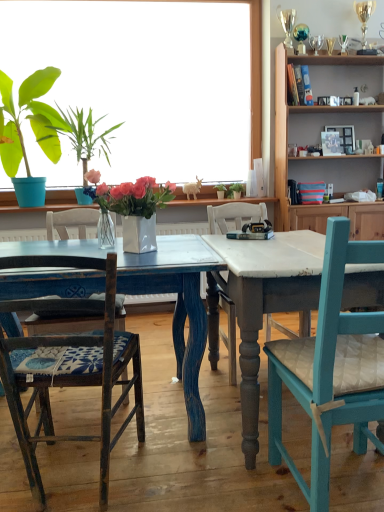
The width and height of the screenshot is (384, 512). Find the location of `green leafy plant at upper left, acting as the fourth houseplant starting from the right`. green leafy plant at upper left, acting as the fourth houseplant starting from the right is located at coordinates point(86,136).

At what (x,y) coordinates should I click in order to perform the action: click on white glossy vase at center, which appears as the fifth houseplant when viewed from the back. Please return your answer as a coordinate pair (x, y). The image size is (384, 512). Looking at the image, I should click on (135, 209).

Locate an element on the screen. This screenshot has height=512, width=384. green leafy plant in blue pot at left, which ranks as the fourth houseplant in back-to-front order is located at coordinates (32, 129).

This screenshot has height=512, width=384. What do you see at coordinates (331, 368) in the screenshot?
I see `teal wood chair at right, acting as the second chair starting from the left` at bounding box center [331, 368].

Where is `green leafy plant at upper left, acting as the 3th houseplant starting from the back`? green leafy plant at upper left, acting as the 3th houseplant starting from the back is located at coordinates (86, 136).

Is the position of green leafy plant at center, the 5th houseplant from the front, less distant than that of distressed blue wood table at center?

That is False.

Which of these two, green leafy plant at center, the first houseplant positioned from the right, or distressed blue wood table at center, is smaller?

green leafy plant at center, the first houseplant positioned from the right.

From a real-world perspective, does green leafy plant at center, the 5th houseplant from the front, stand above distressed blue wood table at center?

Yes, from a real-world perspective, green leafy plant at center, the 5th houseplant from the front, is above distressed blue wood table at center.

Which of these two, green leafy plant at center, which appears as the 1th houseplant when viewed from the back, or distressed blue wood table at center, is wider?

With larger width is distressed blue wood table at center.

Based on the photo, is wooden chair with blue patterned cushion at left, the second chair when ordered from right to left, inside or outside of green leafy plant at center, the 5th houseplant from the front?

wooden chair with blue patterned cushion at left, the second chair when ordered from right to left, lies outside green leafy plant at center, the 5th houseplant from the front.

Is wooden chair with blue patterned cushion at left, the second chair when ordered from right to left, in front of or behind green leafy plant at center, the first houseplant positioned from the right, in the image?

Visually, wooden chair with blue patterned cushion at left, the second chair when ordered from right to left, is located in front of green leafy plant at center, the first houseplant positioned from the right.

Measure the distance from wooden chair with blue patterned cushion at left, the second chair when ordered from right to left, to green leafy plant at center, the first houseplant positioned from the right.

wooden chair with blue patterned cushion at left, the second chair when ordered from right to left, is 2.24 meters away from green leafy plant at center, the first houseplant positioned from the right.

How different are the orientations of wooden chair with blue patterned cushion at left, the second chair when ordered from right to left, and green leafy plant at center, the first houseplant positioned from the right, in degrees?

The angle between the facing direction of wooden chair with blue patterned cushion at left, the second chair when ordered from right to left, and the facing direction of green leafy plant at center, the first houseplant positioned from the right, is 168 degrees.

Based on the photo, from the image's perspective, is green matte plant pot at center, which ranks as the second houseplant in right-to-left order, below white glossy vase at center, which ranks as the first houseplant in front-to-back order?

Incorrect, from the image's perspective, green matte plant pot at center, which ranks as the second houseplant in right-to-left order, is higher than white glossy vase at center, which ranks as the first houseplant in front-to-back order.

What's the angular difference between green matte plant pot at center, the 4th houseplant when ordered from left to right, and white glossy vase at center, which appears as the fifth houseplant when viewed from the back,'s facing directions?

The facing directions of green matte plant pot at center, the 4th houseplant when ordered from left to right, and white glossy vase at center, which appears as the fifth houseplant when viewed from the back, are 39.6 degrees apart.

Is green matte plant pot at center, which ranks as the second houseplant in back-to-front order, touching white glossy vase at center, which ranks as the first houseplant in front-to-back order?

No, green matte plant pot at center, which ranks as the second houseplant in back-to-front order, is not making contact with white glossy vase at center, which ranks as the first houseplant in front-to-back order.

Would you say teal wood chair at right, positioned as the 1th chair in right-to-left order, contains green leafy plant in blue pot at left, which is the 5th houseplant from right to left?

No, green leafy plant in blue pot at left, which is the 5th houseplant from right to left, is located outside of teal wood chair at right, positioned as the 1th chair in right-to-left order.

Which houseplant is the 5th one when counting from the left side of the teal wood chair at right, positioned as the 1th chair in right-to-left order? Please provide its 2D coordinates.

[(32, 129)]

Does point (278, 378) lie in front of point (30, 88)?

That is True.

Considering the sizes of white glossy vase at center, arranged as the third houseplant when viewed from the right, and wooden chair with blue patterned cushion at left, the second chair when ordered from right to left, in the image, is white glossy vase at center, arranged as the third houseplant when viewed from the right, bigger or smaller than wooden chair with blue patterned cushion at left, the second chair when ordered from right to left,?

In the image, white glossy vase at center, arranged as the third houseplant when viewed from the right, appears to be smaller than wooden chair with blue patterned cushion at left, the second chair when ordered from right to left.

Considering the sizes of white glossy vase at center, arranged as the third houseplant when viewed from the right, and wooden chair with blue patterned cushion at left, the second chair when ordered from right to left, in the image, is white glossy vase at center, arranged as the third houseplant when viewed from the right, taller or shorter than wooden chair with blue patterned cushion at left, the second chair when ordered from right to left,?

white glossy vase at center, arranged as the third houseplant when viewed from the right, is shorter than wooden chair with blue patterned cushion at left, the second chair when ordered from right to left.

How many degrees apart are the facing directions of teal wood chair at right, positioned as the 1th chair in right-to-left order, and wooden cabinet at upper right?

179 degrees separate the facing orientations of teal wood chair at right, positioned as the 1th chair in right-to-left order, and wooden cabinet at upper right.

From the image's perspective, would you say teal wood chair at right, positioned as the 1th chair in right-to-left order, is positioned over wooden cabinet at upper right?

No, from the image's perspective, teal wood chair at right, positioned as the 1th chair in right-to-left order, is not above wooden cabinet at upper right.

You are a GUI agent. You are given a task and a screenshot of the screen. Output one action in this format:
    pyautogui.click(x=<x>, y=<y>)
    Task: Click on the cabinetry that appears above the teal wood chair at right, acting as the second chair starting from the left (from a real-world perspective)
    The width and height of the screenshot is (384, 512).
    Given the screenshot: What is the action you would take?
    pyautogui.click(x=281, y=138)

Between teal wood chair at right, positioned as the 1th chair in right-to-left order, and wooden cabinet at upper right, which one has more height?

wooden cabinet at upper right is taller.

Which is in front, wooden chair with blue patterned cushion at left, the 1th chair when ordered from left to right, or green leafy plant in blue pot at left, which ranks as the fourth houseplant in back-to-front order?

wooden chair with blue patterned cushion at left, the 1th chair when ordered from left to right, is more forward.

From the image's perspective, does wooden chair with blue patterned cushion at left, the 1th chair when ordered from left to right, appear higher than green leafy plant in blue pot at left, which is the 5th houseplant from right to left?

No, from the image's perspective, wooden chair with blue patterned cushion at left, the 1th chair when ordered from left to right, is not on top of green leafy plant in blue pot at left, which is the 5th houseplant from right to left.

Locate an element on the screen. This screenshot has width=384, height=512. the 2nd houseplant to the left of the wooden chair with blue patterned cushion at left, the 1th chair when ordered from left to right, starting your count from the anchor is located at coordinates (32, 129).

In order to click on the 5th houseplant behind when counting from the distressed blue wood table at center in this screenshot , I will do `click(236, 190)`.

Identify the location of houseplant that is the 3rd object to the right of the wooden chair with blue patterned cushion at left, the 1th chair when ordered from left to right, starting at the anchor. (236, 190).

Based on their spatial positions, is green leafy plant at center, placed as the fifth houseplant when sorted from left to right, or wooden cabinet at upper right closer to wooden chair with blue patterned cushion at left, the 1th chair when ordered from left to right?

wooden cabinet at upper right is positioned closer to the anchor wooden chair with blue patterned cushion at left, the 1th chair when ordered from left to right.

Estimate the real-world distances between objects in this image. Which object is further from distressed blue wood table at center, green leafy plant in blue pot at left, which is the 5th houseplant from right to left, or wooden chair with blue patterned cushion at left, the 1th chair when ordered from left to right?

green leafy plant in blue pot at left, which is the 5th houseplant from right to left, is positioned further to the anchor distressed blue wood table at center.

Based on the photo, based on their spatial positions, is white glossy vase at center, arranged as the third houseplant when viewed from the right, or green matte plant pot at center, which ranks as the second houseplant in right-to-left order, closer to wooden cabinet at upper right?

green matte plant pot at center, which ranks as the second houseplant in right-to-left order.

When comparing their distances from wooden chair with blue patterned cushion at left, the second chair when ordered from right to left, does teal wood chair at right, acting as the second chair starting from the left, or green leafy plant in blue pot at left, which ranks as the fourth houseplant in back-to-front order, seem further?

green leafy plant in blue pot at left, which ranks as the fourth houseplant in back-to-front order, lies further to wooden chair with blue patterned cushion at left, the second chair when ordered from right to left, than the other object.

Which object lies nearer to the anchor point green leafy plant at upper left, acting as the 3th houseplant starting from the back, green leafy plant in blue pot at left, which is the 2th houseplant in front-to-back order, or green leafy plant at center, the first houseplant positioned from the right?

Among the two, green leafy plant in blue pot at left, which is the 2th houseplant in front-to-back order, is located nearer to green leafy plant at upper left, acting as the 3th houseplant starting from the back.

Which object lies nearer to the anchor point green matte plant pot at center, which appears as the 4th houseplant when viewed from the front, green leafy plant at center, the 5th houseplant from the front, or distressed blue wood table at center?

green leafy plant at center, the 5th houseplant from the front, is closer to green matte plant pot at center, which appears as the 4th houseplant when viewed from the front.

When comparing their distances from teal wood chair at right, positioned as the 1th chair in right-to-left order, does green leafy plant at upper left, which is counted as the third houseplant, starting from the front, or green leafy plant at center, the first houseplant positioned from the right, seem further?

The object further to teal wood chair at right, positioned as the 1th chair in right-to-left order, is green leafy plant at upper left, which is counted as the third houseplant, starting from the front.

Which object lies nearer to the anchor point green matte plant pot at center, which ranks as the second houseplant in back-to-front order, green leafy plant at center, the 5th houseplant from the front, or wooden chair with blue patterned cushion at left, the 1th chair when ordered from left to right?

green leafy plant at center, the 5th houseplant from the front, is closer to green matte plant pot at center, which ranks as the second houseplant in back-to-front order.

Image resolution: width=384 pixels, height=512 pixels. In order to click on cabinetry between white glossy vase at center, arranged as the third houseplant when viewed from the right, and green leafy plant at center, which appears as the 1th houseplant when viewed from the back, from front to back in this screenshot , I will do `click(281, 138)`.

In order to click on kitchen & dining room table located between teal wood chair at right, positioned as the 1th chair in right-to-left order, and green matte plant pot at center, which appears as the 4th houseplant when viewed from the front, in the depth direction in this screenshot , I will do `click(188, 433)`.

The image size is (384, 512). Identify the location of chair between teal wood chair at right, acting as the second chair starting from the left, and green leafy plant at upper left, the 2th houseplant when ordered from left to right, from front to back. (68, 368).

This screenshot has width=384, height=512. I want to click on chair between distressed blue wood table at center and green leafy plant at center, the first houseplant positioned from the right, in the front-back direction, so click(x=68, y=368).